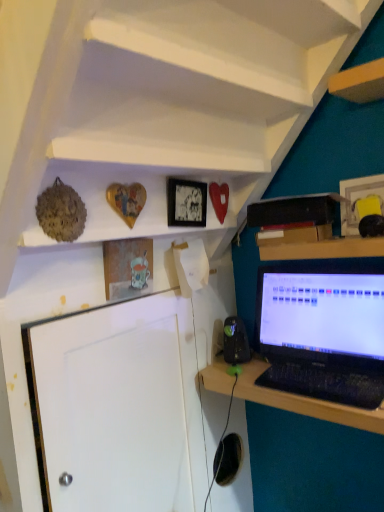
Question: From the image's perspective, does matte glass picture frame at upper center, which is counted as the 3th picture frame, starting from the right, appear lower than black plastic speaker at lower center?

Choices:
 (A) yes
 (B) no

Answer: (B)

Question: Does matte glass picture frame at upper center, which is counted as the 3th picture frame, starting from the right, have a lesser height compared to black plastic speaker at lower center?

Choices:
 (A) no
 (B) yes

Answer: (A)

Question: Considering the relative sizes of matte glass picture frame at upper center, which is counted as the 3th picture frame, starting from the right, and black plastic speaker at lower center in the image provided, is matte glass picture frame at upper center, which is counted as the 3th picture frame, starting from the right, thinner than black plastic speaker at lower center?

Choices:
 (A) yes
 (B) no

Answer: (A)

Question: Can you confirm if matte glass picture frame at upper center, the 1th picture frame positioned from the left, is bigger than black plastic speaker at lower center?

Choices:
 (A) no
 (B) yes

Answer: (B)

Question: Is matte glass picture frame at upper center, the 1th picture frame positioned from the left, at the right side of black plastic speaker at lower center?

Choices:
 (A) no
 (B) yes

Answer: (A)

Question: From a real-world perspective, relative to matte black picture frame at upper center, which ranks as the 2th picture frame in left-to-right order, is wooden heart at upper center, arranged as the 2th shelf when viewed from the top, vertically above or below?

Choices:
 (A) above
 (B) below

Answer: (A)

Question: In terms of width, does wooden heart at upper center, arranged as the 2th shelf when viewed from the top, look wider or thinner when compared to matte black picture frame at upper center, the 2th picture frame viewed from the right?

Choices:
 (A) wide
 (B) thin

Answer: (A)

Question: Is wooden heart at upper center, which is the first shelf in bottom-to-top order, situated inside matte black picture frame at upper center, the 2th picture frame viewed from the right, or outside?

Choices:
 (A) inside
 (B) outside

Answer: (B)

Question: In terms of height, does wooden heart at upper center, arranged as the 2th shelf when viewed from the top, look taller or shorter compared to matte black picture frame at upper center, which ranks as the 2th picture frame in left-to-right order?

Choices:
 (A) short
 (B) tall

Answer: (B)

Question: Choose the correct answer: Is black plastic keyboard at lower right inside matte black picture frame at upper center, the 2th picture frame viewed from the right, or outside it?

Choices:
 (A) outside
 (B) inside

Answer: (A)

Question: Is black plastic keyboard at lower right wider or thinner than matte black picture frame at upper center, which ranks as the 2th picture frame in left-to-right order?

Choices:
 (A) wide
 (B) thin

Answer: (A)

Question: Is black plastic keyboard at lower right taller or shorter than matte black picture frame at upper center, which ranks as the 2th picture frame in left-to-right order?

Choices:
 (A) tall
 (B) short

Answer: (B)

Question: In the image, is black plastic keyboard at lower right on the left side or the right side of matte black picture frame at upper center, the 2th picture frame viewed from the right?

Choices:
 (A) left
 (B) right

Answer: (B)

Question: Is black plastic speaker at lower center in front of or behind wooden heart at upper center, which is the first shelf in bottom-to-top order, in the image?

Choices:
 (A) front
 (B) behind

Answer: (B)

Question: Considering the positions of black plastic speaker at lower center and wooden heart at upper center, arranged as the 2th shelf when viewed from the top, in the image, is black plastic speaker at lower center wider or thinner than wooden heart at upper center, arranged as the 2th shelf when viewed from the top,?

Choices:
 (A) thin
 (B) wide

Answer: (A)